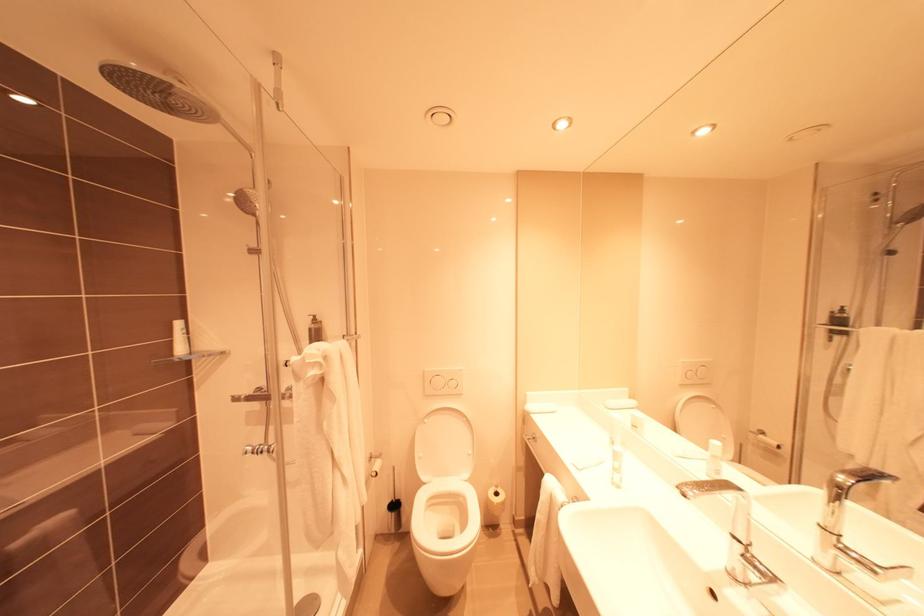
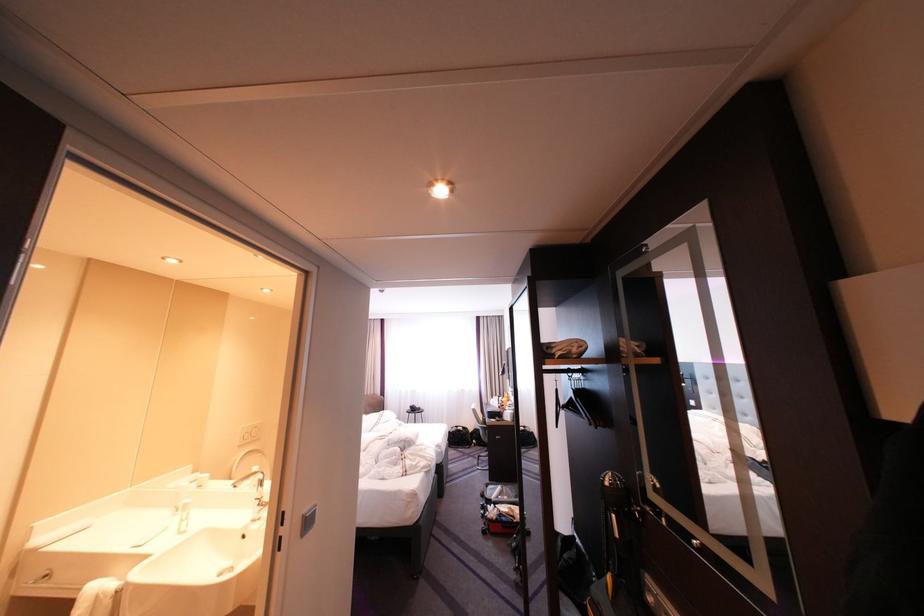
Locate, in the second image, the point that corresponds to the point at 696,363 in the first image.

(254, 429)